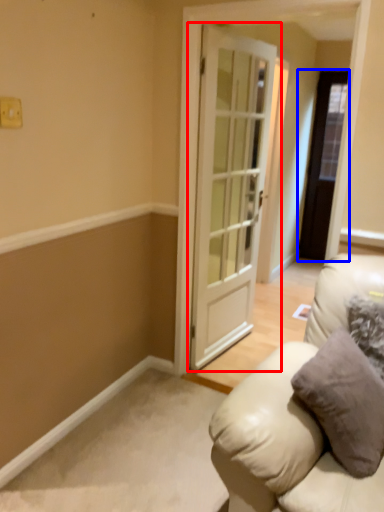
Question: Among these objects, which one is nearest to the camera, door (highlighted by a red box) or door (highlighted by a blue box)?

Choices:
 (A) door
 (B) door

Answer: (A)